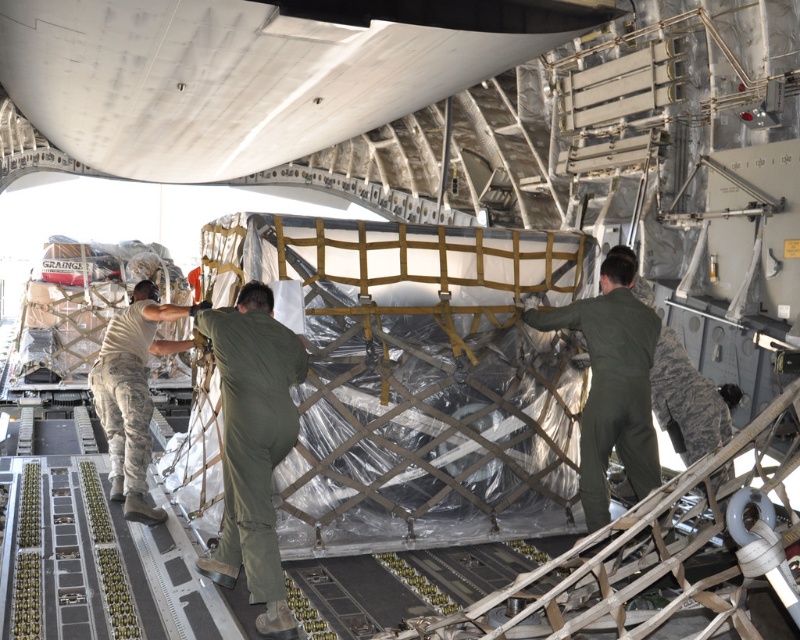
Question: Where is green uniform at center located in relation to camouflage uniform at left in the image?

Choices:
 (A) right
 (B) left

Answer: (A)

Question: Which object is closer to the camera taking this photo?

Choices:
 (A) green matte jumpsuit at center
 (B) green uniform at center

Answer: (B)

Question: Can you confirm if green uniform at center is positioned to the right of camouflage uniform at left?

Choices:
 (A) yes
 (B) no

Answer: (A)

Question: From the image, what is the correct spatial relationship of green uniform at center in relation to green matte jumpsuit at center?

Choices:
 (A) above
 (B) below

Answer: (B)

Question: Which of the following is the closest to the observer?

Choices:
 (A) (244, 433)
 (B) (588, 522)

Answer: (A)

Question: Which point is farther to the camera?

Choices:
 (A) green uniform at center
 (B) green matte jumpsuit at center
 (C) camouflage uniform at left

Answer: (C)